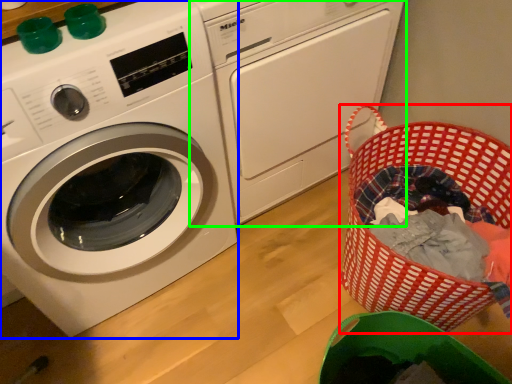
Question: Which object is positioned closest to basket (highlighted by a red box)? Select from washing machine (highlighted by a blue box) and washing machine (highlighted by a green box).

Choices:
 (A) washing machine
 (B) washing machine

Answer: (B)